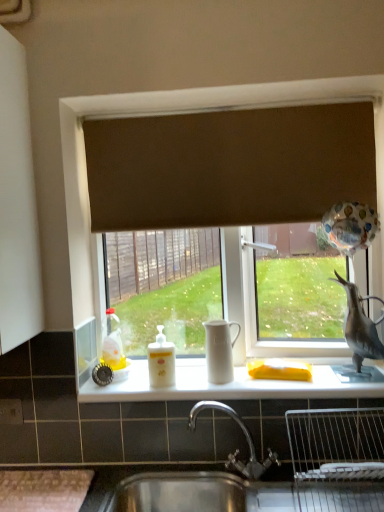
This screenshot has height=512, width=384. What are the coordinates of `vacant region to the left of gray matte bird at right` in the screenshot? It's located at (316, 374).